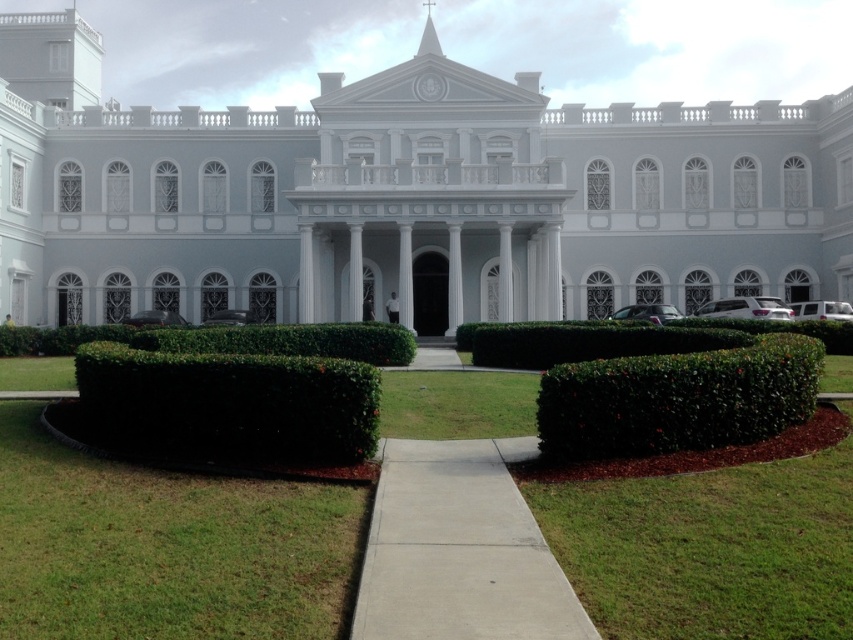
You are standing in front of the building and want to walk to the green leafy hedge at center. Which direction should you move relative to the white marble palace at center?

The white marble palace at center is positioned on the left side of the green leafy hedge at center. To reach the green leafy hedge at center, you should move to the right side of the white marble palace at center.

You are standing on the lawn in front of the building. You see the white marble palace at center and the green leafy bush at lower right. Which object is positioned to the left when facing the building?

The white marble palace at center is to the left of the green leafy bush at lower right.

You are standing on the lawn in front of the grand building. You see a point marked at coordinates [403,196]. What does this point indicate?

The point at coordinates [403,196] marks the white marble palace at center.